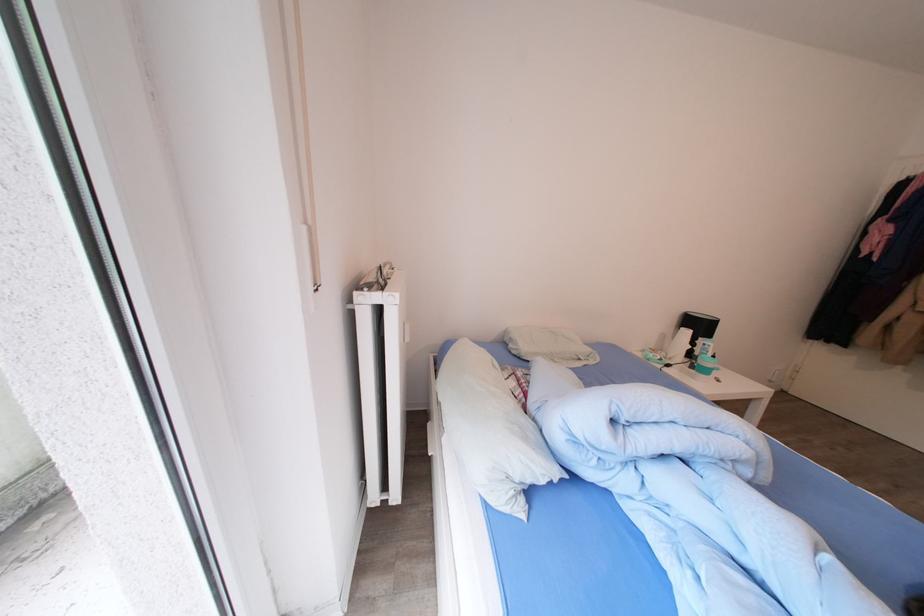
You are a GUI agent. You are given a task and a screenshot of the screen. Output one action in this format:
    pyautogui.click(x=<x>, y=<y>)
    Task: Click on the white pump bottle
    The width and height of the screenshot is (924, 616).
    Given the screenshot: What is the action you would take?
    pyautogui.click(x=706, y=359)